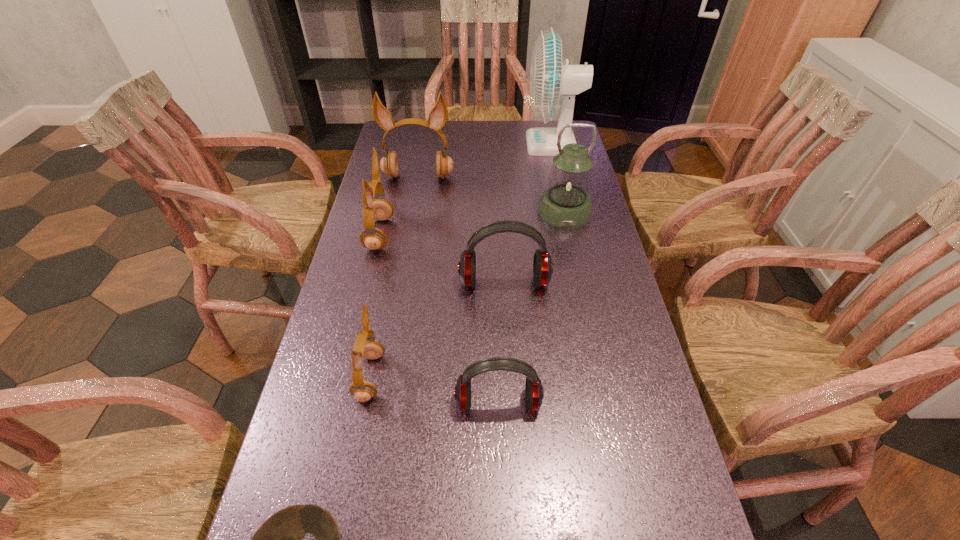
You are a GUI agent. You are given a task and a screenshot of the screen. Output one action in this format:
    pyautogui.click(x=<x>, y=<y>)
    Task: Click on the free region that satisfies the following two spatial constraints: 1. on the front-facing side of the eighth nearest object; 2. on the front-facing side of the smallest brown earphone
    Image resolution: width=960 pixels, height=540 pixels.
    Given the screenshot: What is the action you would take?
    pyautogui.click(x=384, y=376)